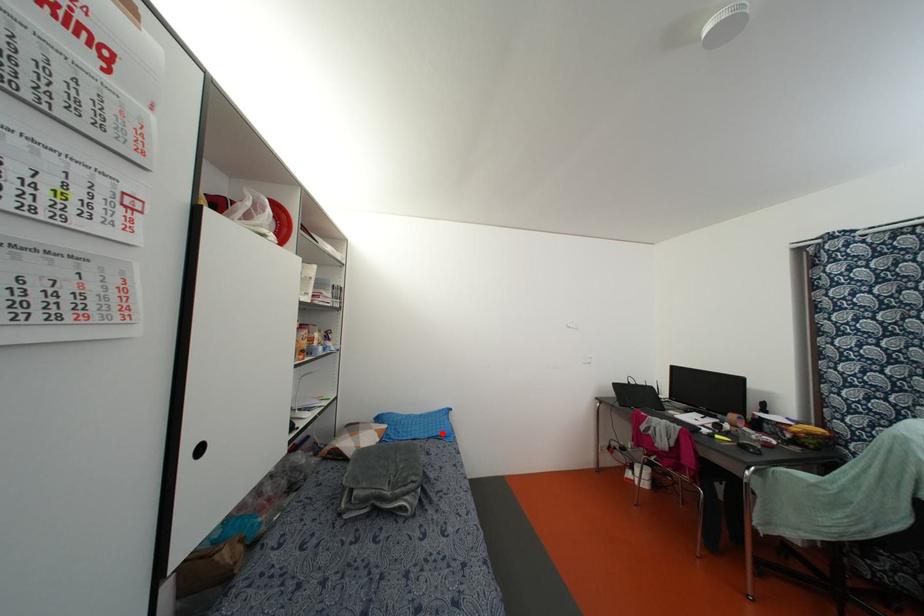
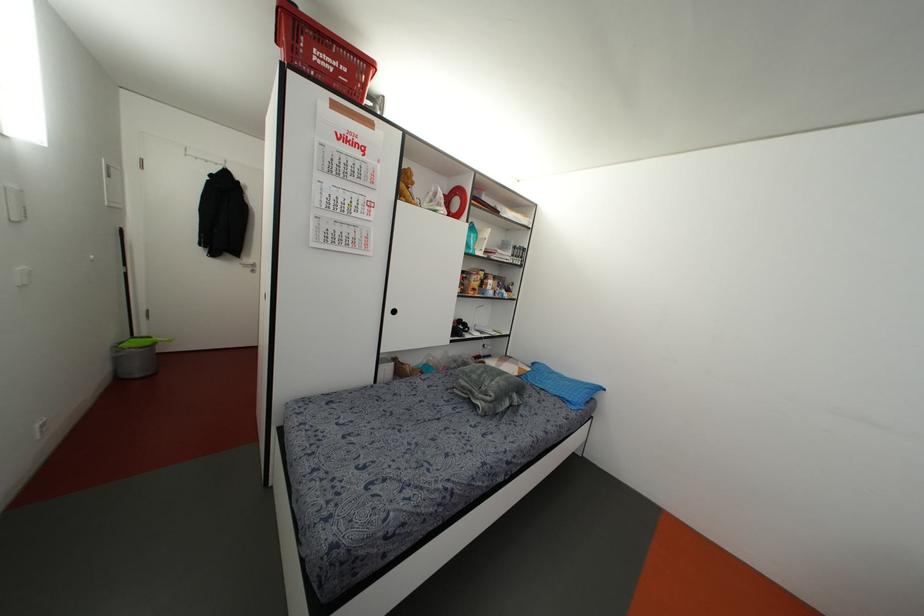
Question: I am providing you with two images of the same scene from different viewpoints. Image1 has a red point marked. In image2, the corresponding 3D location appears at what relative position? Reply with the corresponding letter.

Choices:
 (A) Closer
 (B) Farther

Answer: (A)